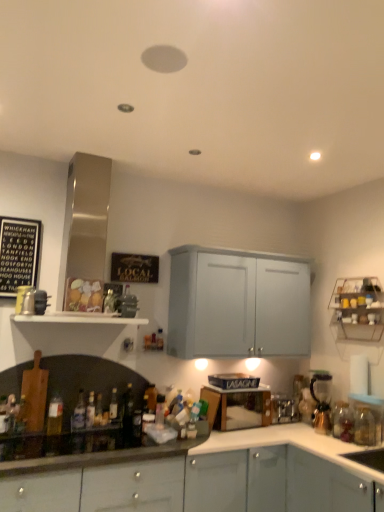
I want to click on free spot to the right of translucent glass bottle at lower left, positioned as the sixth bottle in left-to-right order, so click(115, 432).